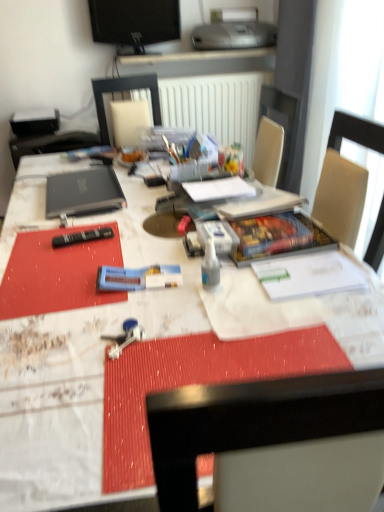
The width and height of the screenshot is (384, 512). What are the coordinates of `vacant space situated on the left part of blue plastic toothpaste tube at center` in the screenshot? It's located at (61, 290).